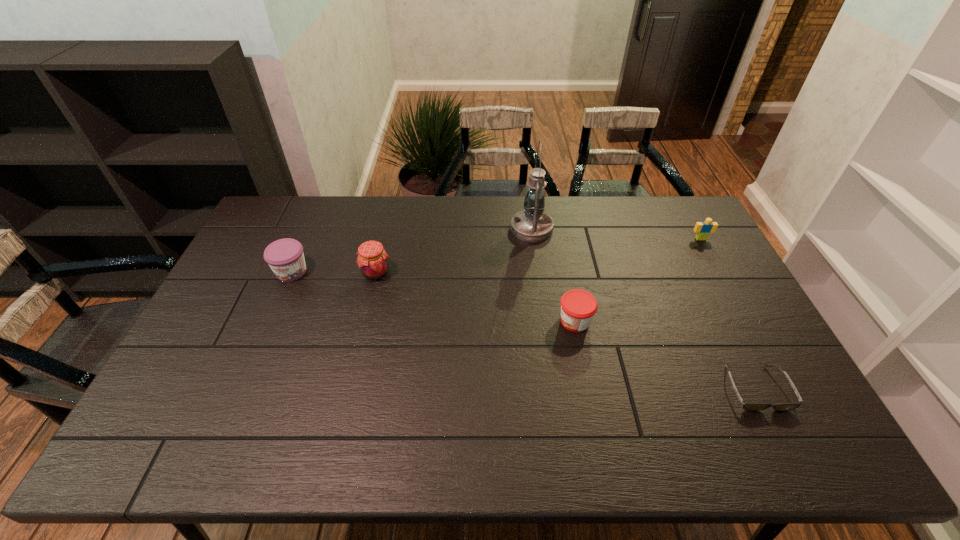
Where is `vacant space at the near edge of the desktop`? This screenshot has height=540, width=960. vacant space at the near edge of the desktop is located at coordinates (440, 440).

Image resolution: width=960 pixels, height=540 pixels. I want to click on vacant space at the left edge of the desktop, so click(x=264, y=303).

Locate an element on the screen. free space at the right edge of the desktop is located at coordinates (735, 343).

Identify the location of free region at the far right corner of the desktop. The image size is (960, 540). (673, 228).

Identify the location of vacant region between the rightmost jam and the nearest object. (665, 354).

Identify the location of empty location between the oil lamp and the rightmost jam. (553, 275).

Identify the location of vacant space that is in between the Lego and the leftmost object. (496, 255).

At what (x,y) coordinates should I click in order to perform the action: click on empty space that is in between the Lego and the nearest jam. Please return your answer as a coordinate pair (x, y). The width and height of the screenshot is (960, 540). Looking at the image, I should click on (637, 280).

Image resolution: width=960 pixels, height=540 pixels. I want to click on free space between the Lego and the leftmost jam, so (x=496, y=255).

At what (x,y) coordinates should I click in order to perform the action: click on empty space between the second object from left to right and the oil lamp. Please return your answer as a coordinate pair (x, y). This screenshot has height=540, width=960. Looking at the image, I should click on (454, 251).